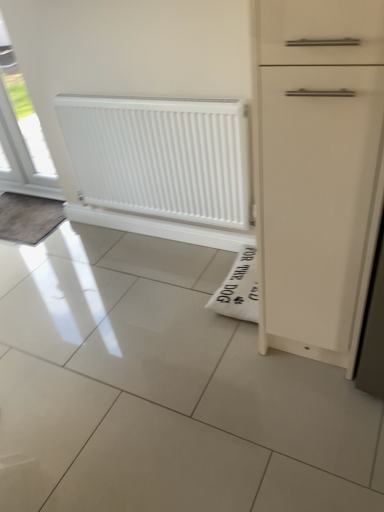
Question: Is white glossy window at upper left in contact with white smooth radiator at center?

Choices:
 (A) yes
 (B) no

Answer: (B)

Question: From the image's perspective, is white glossy window at upper left on top of white smooth radiator at center?

Choices:
 (A) yes
 (B) no

Answer: (A)

Question: Is the depth of white glossy window at upper left greater than that of white smooth radiator at center?

Choices:
 (A) no
 (B) yes

Answer: (B)

Question: From the image's perspective, is white glossy window at upper left below white smooth radiator at center?

Choices:
 (A) yes
 (B) no

Answer: (B)

Question: Is white glossy window at upper left closer to camera compared to white smooth radiator at center?

Choices:
 (A) yes
 (B) no

Answer: (B)

Question: In terms of height, does white glossy window at upper left look taller or shorter compared to white smooth radiator at center?

Choices:
 (A) short
 (B) tall

Answer: (B)

Question: Considering the relative positions of white glossy window at upper left and white smooth radiator at center in the image provided, is white glossy window at upper left to the left or to the right of white smooth radiator at center?

Choices:
 (A) right
 (B) left

Answer: (B)

Question: Does point (1, 114) appear closer or farther from the camera than point (94, 200)?

Choices:
 (A) closer
 (B) farther

Answer: (B)

Question: Relative to white smooth radiator at center, is white glossy window at upper left in front or behind?

Choices:
 (A) behind
 (B) front

Answer: (A)

Question: From their relative heights in the image, would you say white smooth radiator at center is taller or shorter than dark gray textured mat at left?

Choices:
 (A) tall
 (B) short

Answer: (A)

Question: Is white smooth radiator at center situated inside dark gray textured mat at left or outside?

Choices:
 (A) outside
 (B) inside

Answer: (A)

Question: From the image's perspective, relative to dark gray textured mat at left, is white smooth radiator at center above or below?

Choices:
 (A) below
 (B) above

Answer: (B)

Question: In the image, is white smooth radiator at center on the left side or the right side of dark gray textured mat at left?

Choices:
 (A) right
 (B) left

Answer: (A)

Question: Would you say white glossy window at upper left is to the left or to the right of dark gray textured mat at left in the picture?

Choices:
 (A) left
 (B) right

Answer: (B)

Question: Considering the positions of white glossy window at upper left and dark gray textured mat at left in the image, is white glossy window at upper left bigger or smaller than dark gray textured mat at left?

Choices:
 (A) small
 (B) big

Answer: (B)